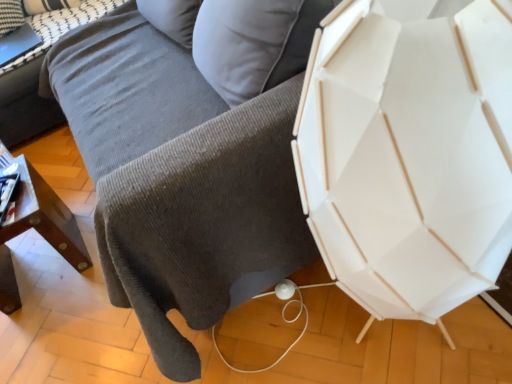
The height and width of the screenshot is (384, 512). I want to click on vacant space in front of wooden table at lower left, so (x=55, y=326).